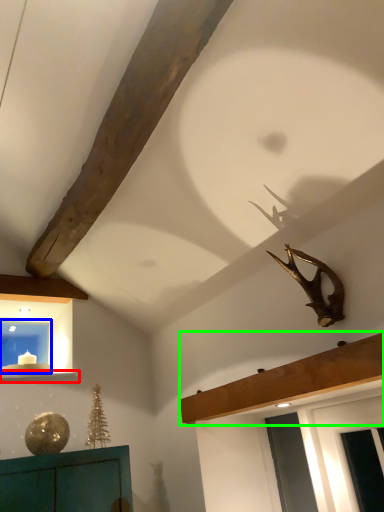
Question: Which object is positioned farthest from window sill (highlighted by a red box)? Select from window (highlighted by a blue box) and shelf (highlighted by a green box).

Choices:
 (A) window
 (B) shelf

Answer: (B)